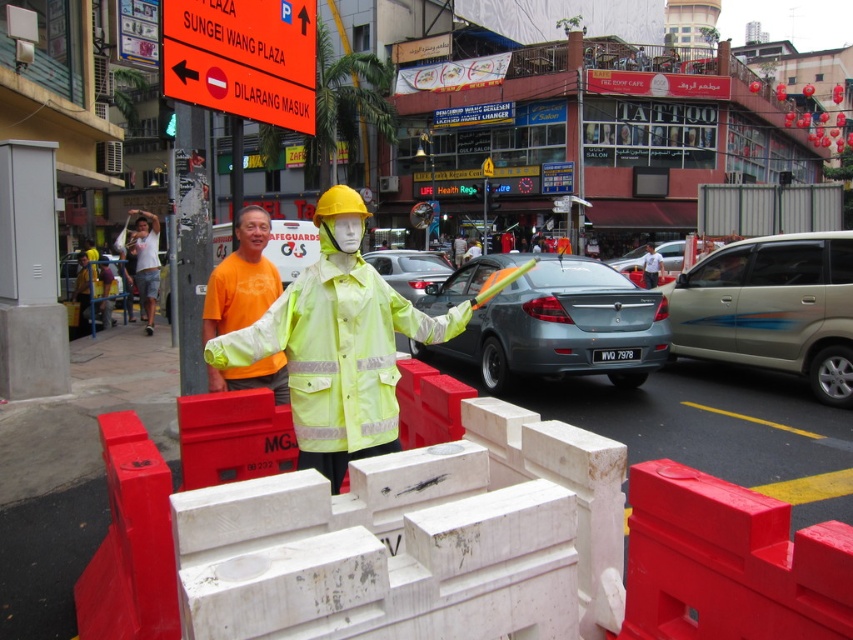
Is neon yellow reflective jacket at center thinner than metallic gray sedan at center?

Yes.

Is point (347, 452) positioned before point (613, 289)?

Yes, it is.

I want to click on neon yellow reflective jacket at center, so click(x=338, y=344).

Measure the distance from matte gray sedan at center to white cotton t-shirt at left.

They are 6.03 meters apart.

Is point (432, 253) closer to camera compared to point (154, 285)?

No, it is behind (154, 285).

Is point (422, 275) closer to camera compared to point (149, 253)?

That is False.

You are a GUI agent. You are given a task and a screenshot of the screen. Output one action in this format:
    pyautogui.click(x=<x>, y=<y>)
    Task: Click on the matte gray sedan at center
    This screenshot has height=640, width=853.
    Given the screenshot: What is the action you would take?
    pyautogui.click(x=409, y=269)

Who is more distant from viewer, (552, 269) or (434, 276)?

Positioned behind is point (434, 276).

Which is behind, point (537, 300) or point (426, 276)?

Point (426, 276)

Image resolution: width=853 pixels, height=640 pixels. I want to click on metallic gray sedan at center, so click(x=564, y=326).